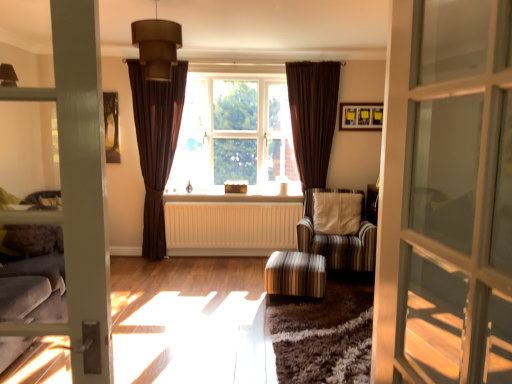
Question: Can you confirm if brown fabric window at center is taller than brown velvet curtain at right, acting as the 2th curtain starting from the left?

Choices:
 (A) yes
 (B) no

Answer: (B)

Question: From the image's perspective, is brown fabric window at center on top of brown velvet curtain at right, acting as the 2th curtain starting from the left?

Choices:
 (A) yes
 (B) no

Answer: (A)

Question: Is brown fabric window at center positioned far away from brown velvet curtain at right, which ranks as the 1th curtain in right-to-left order?

Choices:
 (A) yes
 (B) no

Answer: (B)

Question: Is brown fabric window at center thinner than brown velvet curtain at right, which ranks as the 1th curtain in right-to-left order?

Choices:
 (A) yes
 (B) no

Answer: (B)

Question: Is brown fabric window at center further to camera compared to brown velvet curtain at right, which ranks as the 1th curtain in right-to-left order?

Choices:
 (A) yes
 (B) no

Answer: (A)

Question: Is striped fabric armchair at center in front of or behind brown fabric window at center in the image?

Choices:
 (A) front
 (B) behind

Answer: (A)

Question: From their relative heights in the image, would you say striped fabric armchair at center is taller or shorter than brown fabric window at center?

Choices:
 (A) tall
 (B) short

Answer: (B)

Question: Considering the relative positions of striped fabric armchair at center and brown fabric window at center in the image provided, is striped fabric armchair at center to the left or to the right of brown fabric window at center?

Choices:
 (A) left
 (B) right

Answer: (B)

Question: Looking at their shapes, would you say striped fabric armchair at center is wider or thinner than brown fabric window at center?

Choices:
 (A) thin
 (B) wide

Answer: (B)

Question: Does point (155, 114) appear closer or farther from the camera than point (322, 134)?

Choices:
 (A) closer
 (B) farther

Answer: (A)

Question: From a real-world perspective, relative to brown velvet curtain at right, which ranks as the 1th curtain in right-to-left order, is brown textured curtain at center, which is counted as the 1th curtain, starting from the left, vertically above or below?

Choices:
 (A) above
 (B) below

Answer: (B)

Question: Is brown textured curtain at center, which ranks as the 2th curtain in right-to-left order, inside or outside of brown velvet curtain at right, acting as the 2th curtain starting from the left?

Choices:
 (A) outside
 (B) inside

Answer: (A)

Question: In terms of width, does brown textured curtain at center, which ranks as the 2th curtain in right-to-left order, look wider or thinner when compared to brown velvet curtain at right, acting as the 2th curtain starting from the left?

Choices:
 (A) thin
 (B) wide

Answer: (B)

Question: Is brown textured curtain at center, which ranks as the 2th curtain in right-to-left order, spatially inside white painted wood at center, or outside of it?

Choices:
 (A) outside
 (B) inside

Answer: (A)

Question: Is brown textured curtain at center, which ranks as the 2th curtain in right-to-left order, to the left or to the right of white painted wood at center in the image?

Choices:
 (A) right
 (B) left

Answer: (B)